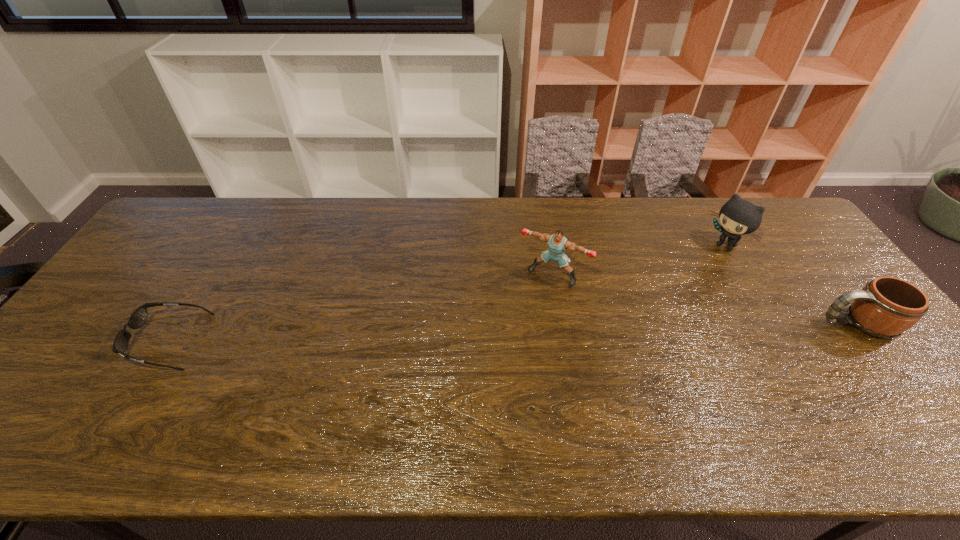
You are a GUI agent. You are given a task and a screenshot of the screen. Output one action in this format:
    pyautogui.click(x=<x>, y=<y>)
    Task: Click on the object situated at the far edge
    
    Given the screenshot: What is the action you would take?
    pyautogui.click(x=737, y=217)

This screenshot has width=960, height=540. What are the coordinates of `object that is at the right edge` in the screenshot? It's located at (886, 307).

Identify the location of vacant space at the far edge of the desktop. click(x=405, y=198).

Locate an element on the screen. Image resolution: width=960 pixels, height=540 pixels. free space at the near edge is located at coordinates (606, 382).

Identify the location of free space at the right edge of the desktop. (829, 266).

Find the location of a particular element. free space at the far left corner of the desktop is located at coordinates (196, 221).

Identify the location of vacant space that's between the leftmost object and the rightmost object. (514, 332).

Where is `free space between the rightmost object and the shortest object`? free space between the rightmost object and the shortest object is located at coordinates (514, 332).

At what (x,y) coordinates should I click in order to perform the action: click on free space between the second shortest object and the third object from right to left. Please return your answer as a coordinate pair (x, y). The image size is (960, 540). Looking at the image, I should click on (705, 300).

You are a GUI agent. You are given a task and a screenshot of the screen. Output one action in this format:
    pyautogui.click(x=<x>, y=<y>)
    Task: Click on the free space between the leftmost object and the rightmost object
    
    Given the screenshot: What is the action you would take?
    pyautogui.click(x=514, y=332)